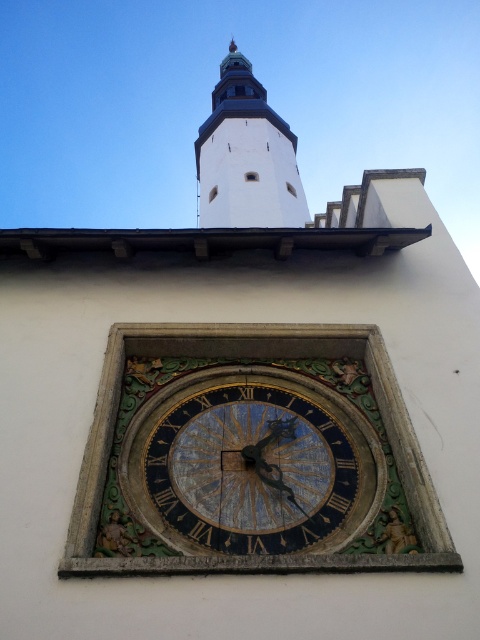
Who is higher up, gold textured clock at center or white stone bell tower at upper center?

white stone bell tower at upper center is higher up.

Does gold textured clock at center have a lesser width compared to white stone bell tower at upper center?

Indeed, gold textured clock at center has a lesser width compared to white stone bell tower at upper center.

Who is more distant from viewer, (219, 396) or (286, 186)?

The point (286, 186) is more distant.

Find the location of a particular element. The height and width of the screenshot is (640, 480). gold textured clock at center is located at coordinates (252, 461).